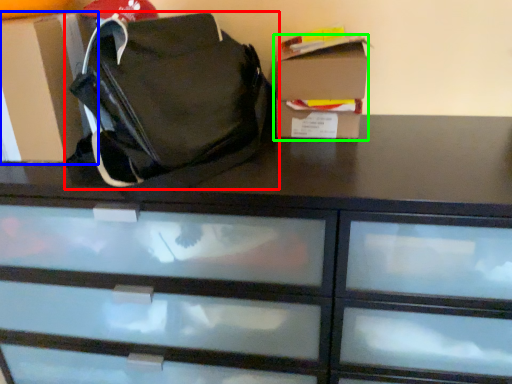
Question: Which object is positioned farthest from handbag (highlighted by a red box)? Select from cardboard box (highlighted by a blue box) and storage box (highlighted by a green box).

Choices:
 (A) cardboard box
 (B) storage box

Answer: (B)